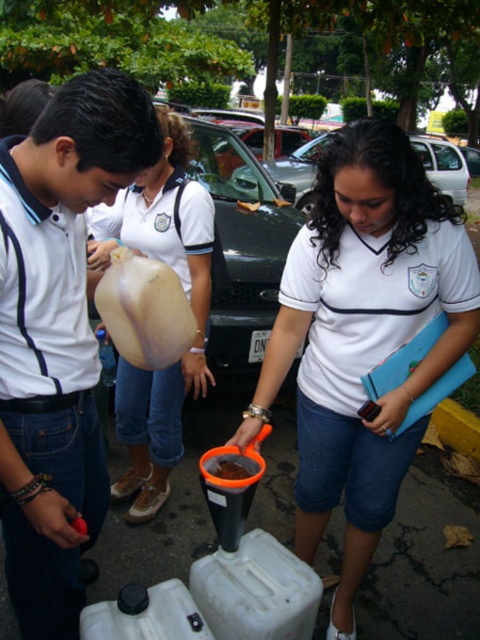
You are standing in the parking area and want to take a photo of both the point at coordinates point (326,289) and point (283,164). Which point should you focus on first to ensure both are in focus?

You should focus on point (326,289) first because it is closer to the camera than point (283,164). This ensures the closer point is in focus, and the farther point will also be within the depth of field.

You are standing in the parking area and see two matte white balloons. Which one is nearer to you, the matte white balloon at left or the matte white balloon at center?

The matte white balloon at left is closer to the viewer than the matte white balloon at center, so the matte white balloon at left is nearer to you.